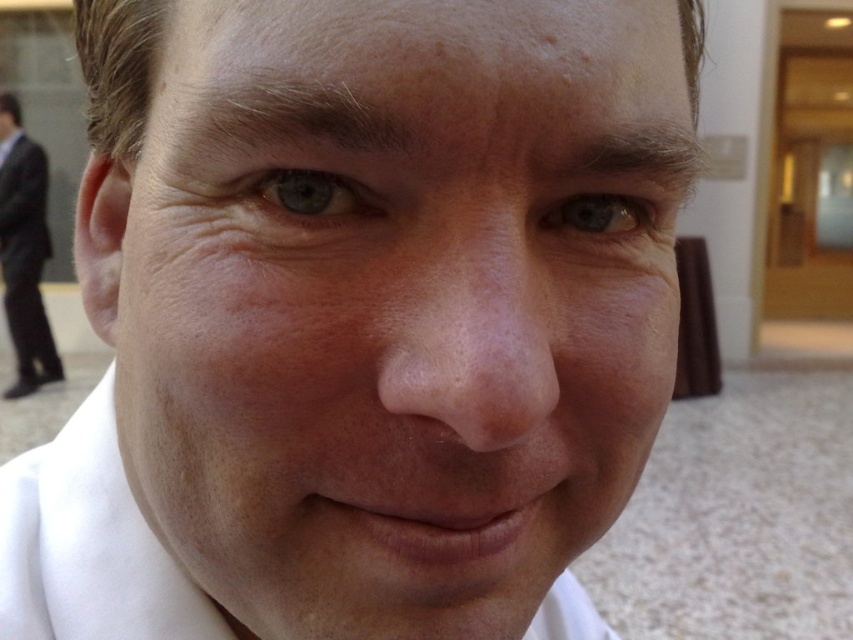
Question: Which point appears farthest from the camera in this image?

Choices:
 (A) (39, 557)
 (B) (546, 276)
 (C) (294, 193)
 (D) (50, 348)

Answer: (D)

Question: Is blue matte eye at upper left closer to the viewer compared to brown matte eye at center?

Choices:
 (A) yes
 (B) no

Answer: (A)

Question: Is white matte dress shirt at center below blue matte eye at upper left?

Choices:
 (A) yes
 (B) no

Answer: (A)

Question: Is smooth skin face at center in front of blue matte eye at upper left?

Choices:
 (A) no
 (B) yes

Answer: (B)

Question: Estimate the real-world distances between objects in this image. Which object is farther from the smooth skin face at center?

Choices:
 (A) blue matte eye at upper left
 (B) black suit at left

Answer: (B)

Question: Which of the following is the closest to the observer?

Choices:
 (A) blue matte eye at upper left
 (B) brown matte eye at center
 (C) smooth skin face at center

Answer: (C)